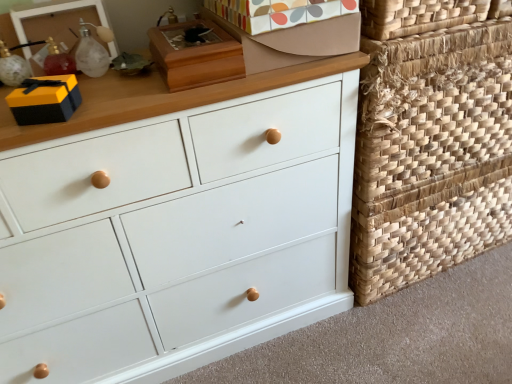
Locate an element on the screen. Image resolution: width=512 pixels, height=384 pixels. free space in front of wooden shoe box at upper center, placed as the 1th shoe box when sorted from left to right is located at coordinates (157, 100).